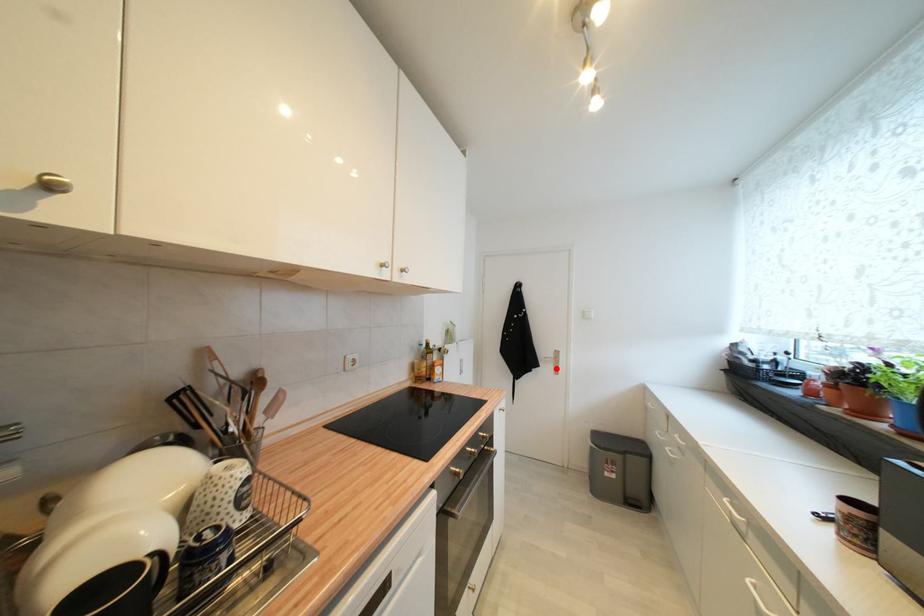
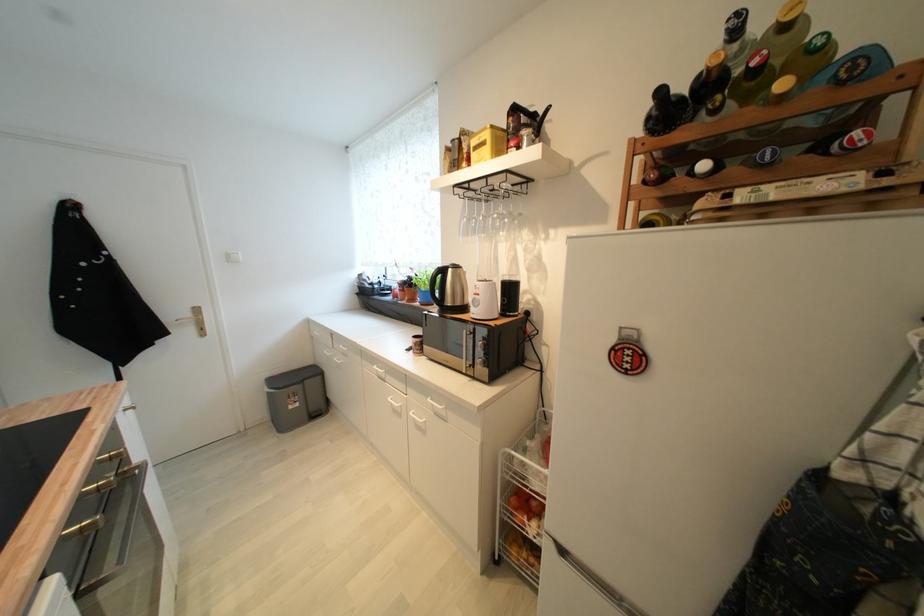
Where in the second image is the point corresponding to the highlighted location from the first image?

(197, 331)